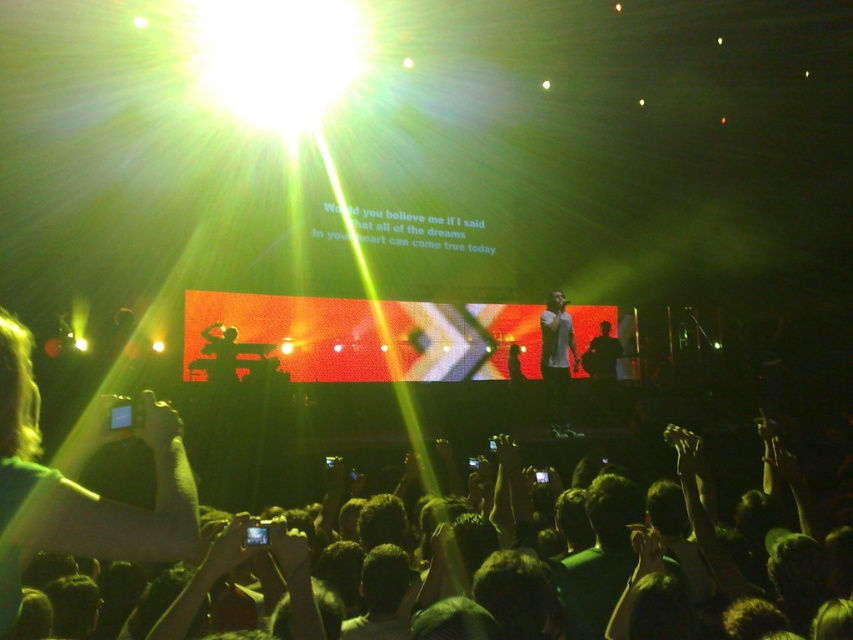
Question: Is white matte shirt at center closer to camera compared to silhouette figure at center?

Choices:
 (A) yes
 (B) no

Answer: (A)

Question: Can you confirm if white matte shirt at center is positioned above silhouette figure at center?

Choices:
 (A) no
 (B) yes

Answer: (A)

Question: Considering the relative positions of white matte shirt at center and silhouette figure at center in the image provided, where is white matte shirt at center located with respect to silhouette figure at center?

Choices:
 (A) above
 (B) below

Answer: (B)

Question: Which object appears closest to the camera in this image?

Choices:
 (A) silhouette figure at center
 (B) white matte shirt at center

Answer: (B)